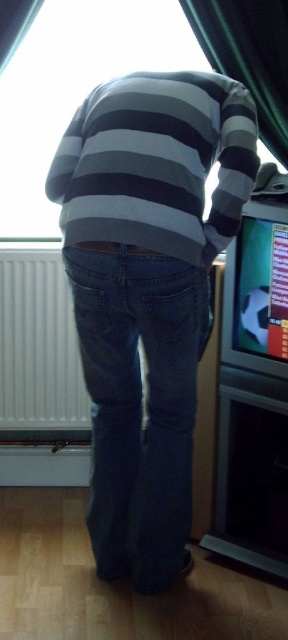
Question: Does denim jeans at center appear on the right side of white plastic radiator at lower left?

Choices:
 (A) yes
 (B) no

Answer: (A)

Question: Does denim jeans at center have a larger size compared to green fabric curtain at upper center?

Choices:
 (A) no
 (B) yes

Answer: (B)

Question: Which point is closer to the camera?

Choices:
 (A) (135, 68)
 (B) (281, 141)

Answer: (B)

Question: Does denim jeans at center appear on the left side of green fabric curtain at upper center?

Choices:
 (A) yes
 (B) no

Answer: (A)

Question: Which of the following is the closest to the observer?

Choices:
 (A) transparent glass window at upper center
 (B) denim jeans at center

Answer: (B)

Question: Which point is farther to the camera?

Choices:
 (A) (124, 497)
 (B) (19, 259)
 (C) (27, 173)

Answer: (C)